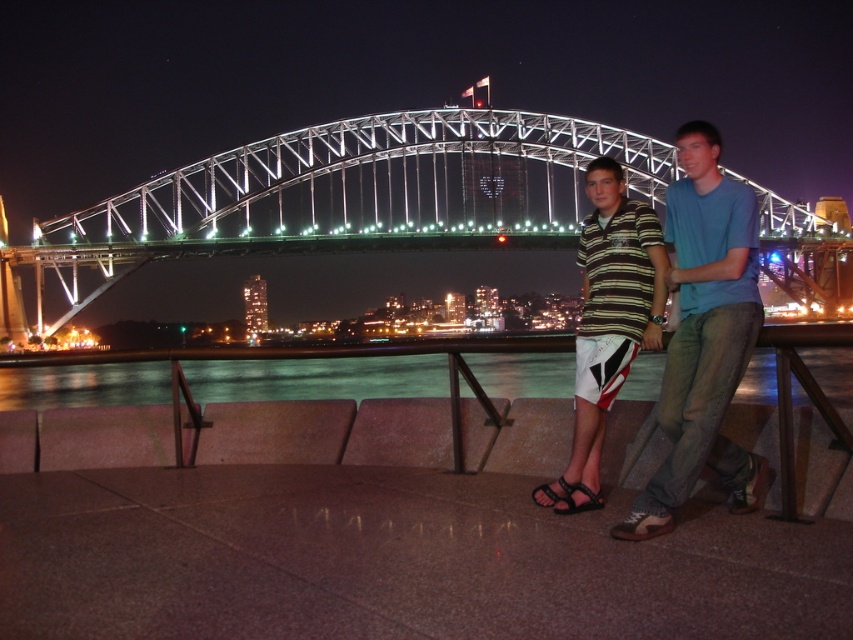
You are standing at the waterfront and see the metallic steel bridge at center and the black rubber sandal at lower center. Which object is closer to the camera?

The black rubber sandal at lower center is closer to the camera because the metallic steel bridge at center is located above it, meaning the sandal is in front of the bridge in the scene.

You are a photographer standing in front of the Sydney Harbour Bridge at night. You see two people on a low wall in the foreground. One is wearing a blue cotton shirt at center and the other a striped cotton shirt at center. Which person is sitting higher on the wall?

The blue cotton shirt at center is positioned over the striped cotton shirt at center, meaning the person wearing the blue cotton shirt at center is sitting higher on the wall.